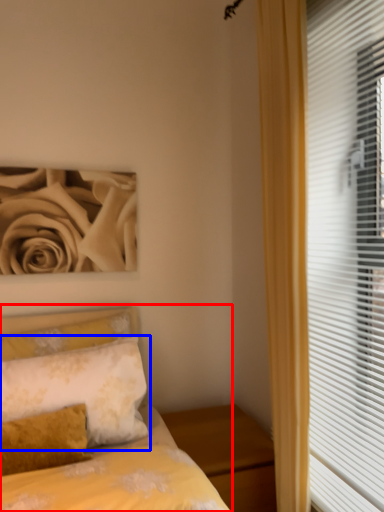
Question: Which object is further to the camera taking this photo, bed (highlighted by a red box) or pillow (highlighted by a blue box)?

Choices:
 (A) bed
 (B) pillow

Answer: (B)